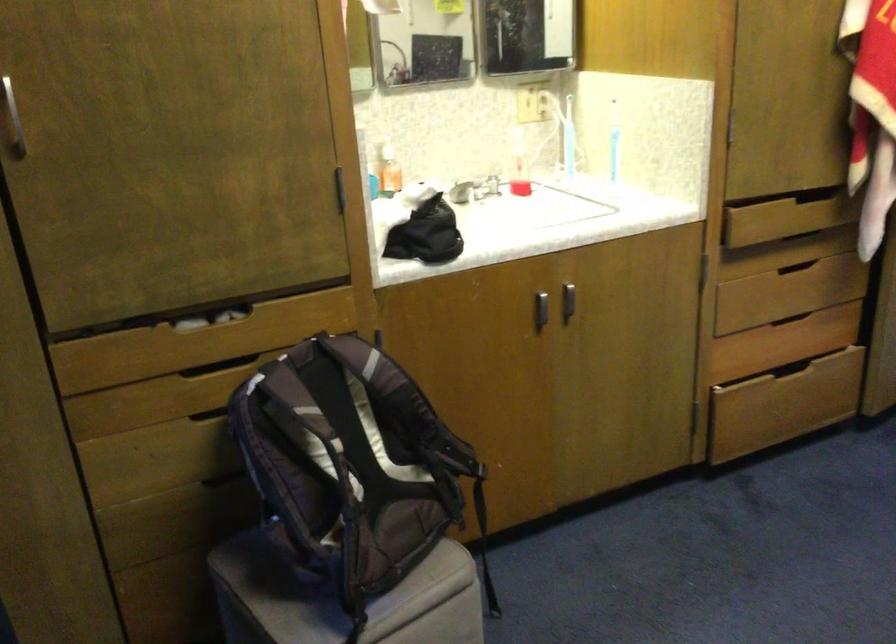
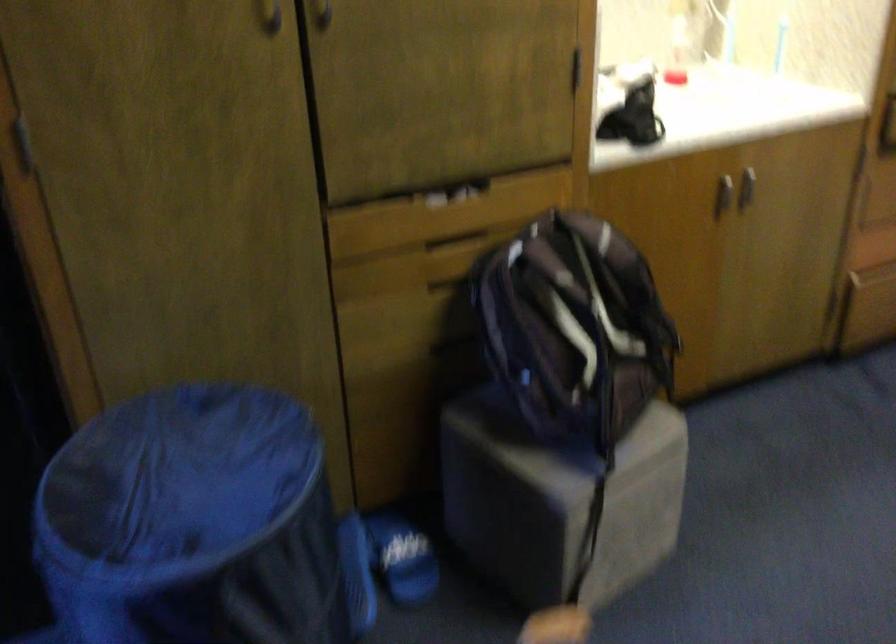
The point at (x=569, y=303) is marked in the first image. Where is the corresponding point in the second image?

(746, 187)